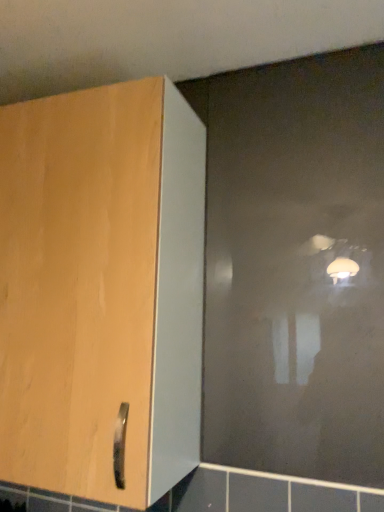
Question: Is matte ceramic tile at lower left to the left of transparent matte glass door at upper right from the viewer's perspective?

Choices:
 (A) no
 (B) yes

Answer: (B)

Question: Can we say matte ceramic tile at lower left lies outside transparent matte glass door at upper right?

Choices:
 (A) yes
 (B) no

Answer: (A)

Question: Considering the relative sizes of matte ceramic tile at lower left and transparent matte glass door at upper right in the image provided, is matte ceramic tile at lower left taller than transparent matte glass door at upper right?

Choices:
 (A) yes
 (B) no

Answer: (B)

Question: From the image's perspective, is matte ceramic tile at lower left located beneath transparent matte glass door at upper right?

Choices:
 (A) yes
 (B) no

Answer: (A)

Question: Could you tell me if matte ceramic tile at lower left is turned towards transparent matte glass door at upper right?

Choices:
 (A) yes
 (B) no

Answer: (B)

Question: Is point (350, 155) positioned closer to the camera than point (1, 490)?

Choices:
 (A) farther
 (B) closer

Answer: (B)

Question: Considering their positions, is transparent matte glass door at upper right located in front of or behind matte ceramic tile at lower left?

Choices:
 (A) front
 (B) behind

Answer: (A)

Question: Considering the positions of transparent matte glass door at upper right and matte ceramic tile at lower left in the image, is transparent matte glass door at upper right taller or shorter than matte ceramic tile at lower left?

Choices:
 (A) tall
 (B) short

Answer: (A)

Question: Considering the positions of transparent matte glass door at upper right and matte ceramic tile at lower left in the image, is transparent matte glass door at upper right wider or thinner than matte ceramic tile at lower left?

Choices:
 (A) thin
 (B) wide

Answer: (A)

Question: Is matte ceramic tile at lower left spatially inside transparent matte glass door at upper right, or outside of it?

Choices:
 (A) outside
 (B) inside

Answer: (A)

Question: In the image, is matte ceramic tile at lower left positioned in front of or behind transparent matte glass door at upper right?

Choices:
 (A) behind
 (B) front

Answer: (A)

Question: Is point (3, 490) closer or farther from the camera than point (309, 100)?

Choices:
 (A) closer
 (B) farther

Answer: (A)

Question: Is matte ceramic tile at lower left taller or shorter than transparent matte glass door at upper right?

Choices:
 (A) short
 (B) tall

Answer: (A)

Question: Considering the positions of transparent matte glass door at upper right and matte wood cupboard at left in the image, is transparent matte glass door at upper right wider or thinner than matte wood cupboard at left?

Choices:
 (A) wide
 (B) thin

Answer: (B)

Question: Is transparent matte glass door at upper right taller or shorter than matte wood cupboard at left?

Choices:
 (A) short
 (B) tall

Answer: (B)